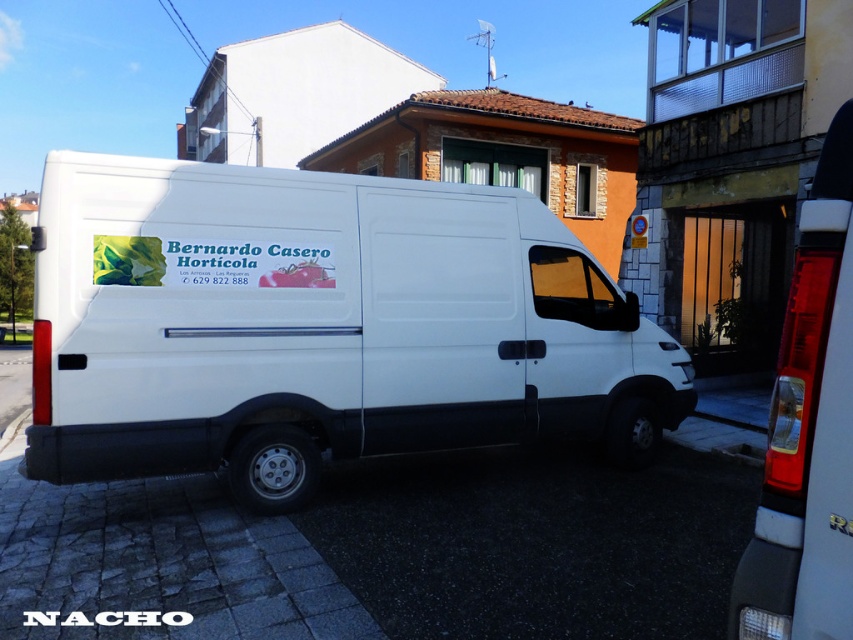
Is white matte van at center closer to the viewer compared to white concrete curb at lower right?

No, white matte van at center is further to the viewer.

At what (x,y) coordinates should I click in order to perform the action: click on white matte van at center. Please return your answer as a coordinate pair (x, y). The image size is (853, 640). Looking at the image, I should click on (320, 326).

Where is `white matte van at center`? The image size is (853, 640). white matte van at center is located at coordinates (320, 326).